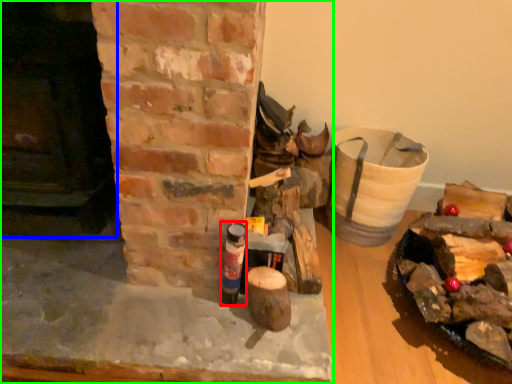
Question: Which is nearer to the bottle (highlighted by a red box)? fireplace (highlighted by a blue box) or fireplace (highlighted by a green box).

Choices:
 (A) fireplace
 (B) fireplace

Answer: (B)